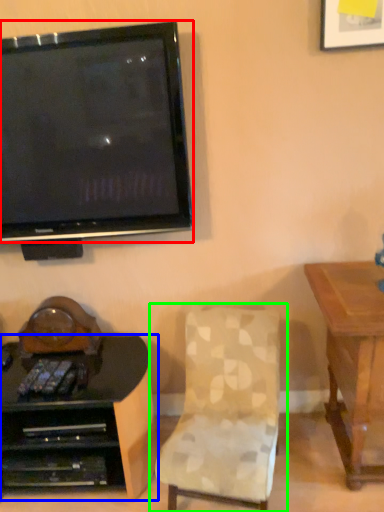
Question: Considering the real-world distances, which object is farthest from television (highlighted by a red box)? desk (highlighted by a blue box) or chair (highlighted by a green box)?

Choices:
 (A) desk
 (B) chair

Answer: (A)